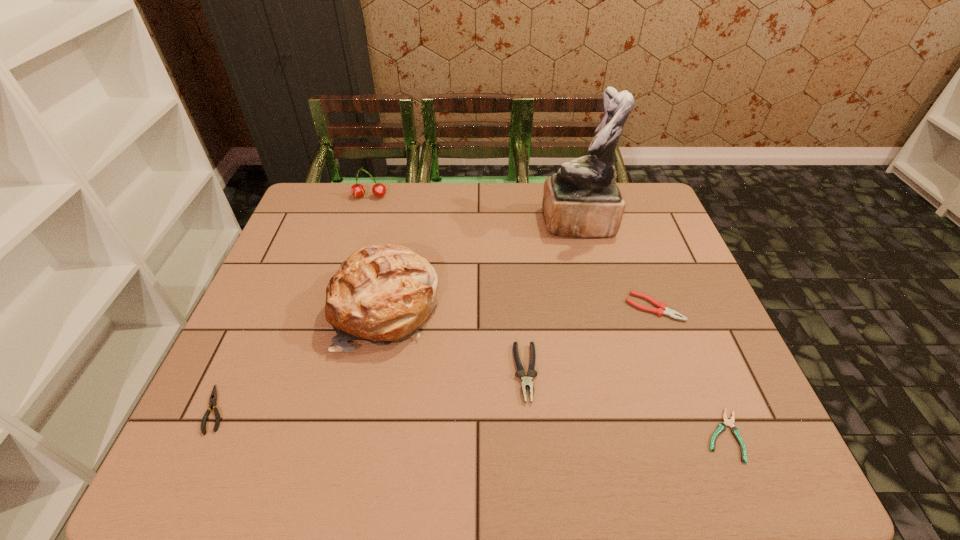
You are a GUI agent. You are given a task and a screenshot of the screen. Output one action in this format:
    pyautogui.click(x=<x>, y=<y>)
    Task: Click on the second shortest pliers
    The height and width of the screenshot is (540, 960).
    Given the screenshot: What is the action you would take?
    pyautogui.click(x=213, y=397)

At what (x,y) coordinates should I click in order to perform the action: click on the shortest object. Please return your answer as a coordinate pair (x, y). The width and height of the screenshot is (960, 540). Looking at the image, I should click on (722, 426).

Identify the location of free space located 0.220m in a relaxed pose on the tallest object. The height and width of the screenshot is (540, 960). (472, 224).

The width and height of the screenshot is (960, 540). I want to click on free space located in a relaxed pose on the tallest object, so click(x=517, y=224).

I want to click on vacant space located in a relaxed pose on the tallest object, so click(x=495, y=224).

Where is `vacant space located on the right of the bread`? vacant space located on the right of the bread is located at coordinates (572, 308).

What are the coordinates of `vacant space located 0.070m with stems pointing upwards on the cherry` in the screenshot? It's located at (365, 214).

Where is `free space located at the gripping part of the second pliers from left to right`? This screenshot has height=540, width=960. free space located at the gripping part of the second pliers from left to right is located at coordinates (532, 446).

Identify the location of vacant space located on the back of the third shortest object. (622, 222).

Identify the location of vacant region located on the front of the second shortest pliers. This screenshot has height=540, width=960. (192, 461).